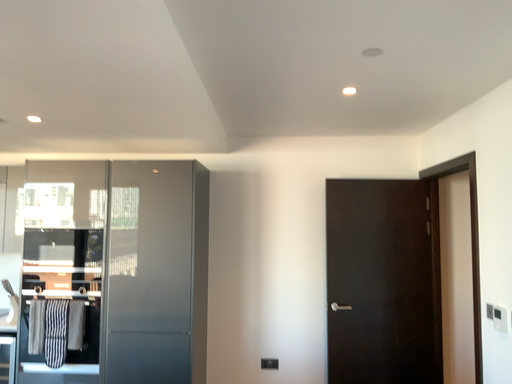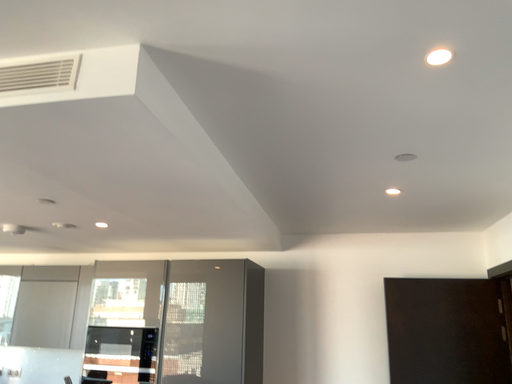
Question: Which way did the camera rotate in the video?

Choices:
 (A) rotated upward
 (B) rotated downward

Answer: (A)